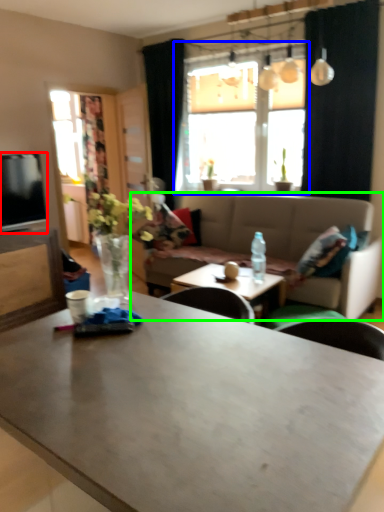
Question: Estimate the real-world distances between objects in this image. Which object is closer to television (highlighted by a red box), window (highlighted by a blue box) or studio couch (highlighted by a green box)?

Choices:
 (A) window
 (B) studio couch

Answer: (B)